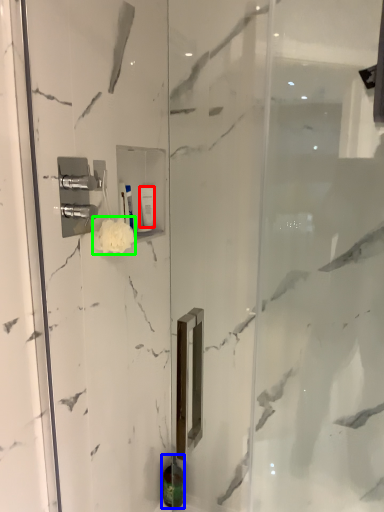
Question: Considering the real-world distances, which object is closest to toiletry (highlighted by a red box)? toiletry (highlighted by a blue box) or flower (highlighted by a green box).

Choices:
 (A) toiletry
 (B) flower

Answer: (B)